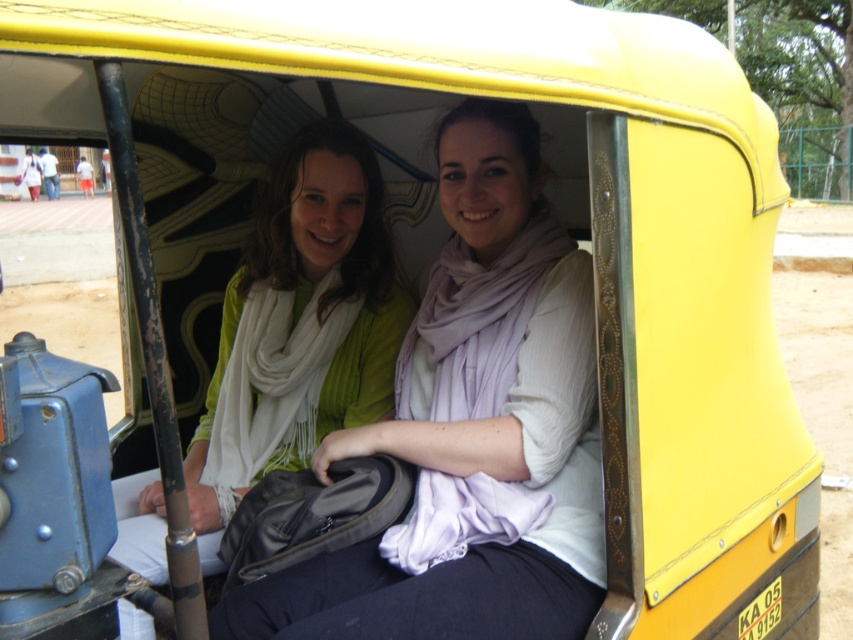
Is matte white scarf at center wider than matte green sweater at center?

Incorrect, matte white scarf at center's width does not surpass matte green sweater at center's.

Consider the image. Which of these two, matte white scarf at center or matte green sweater at center, stands shorter?

matte white scarf at center

This screenshot has height=640, width=853. Find the location of `matte white scarf at center`. matte white scarf at center is located at coordinates (473, 428).